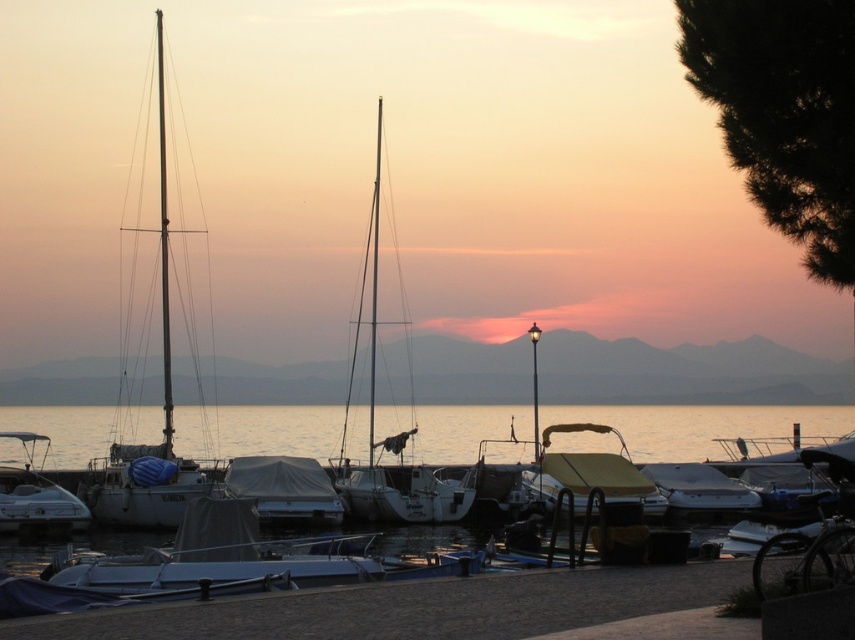
You are a photographer planning to capture the reflection of the white matte boat at center in the clear water at center. Based on the scene, do you think the reflection will be fully visible within the water?

The clear water at center has a larger width than the white matte boat at center, so the reflection of the white matte boat at center should be fully visible within the clear water at center.